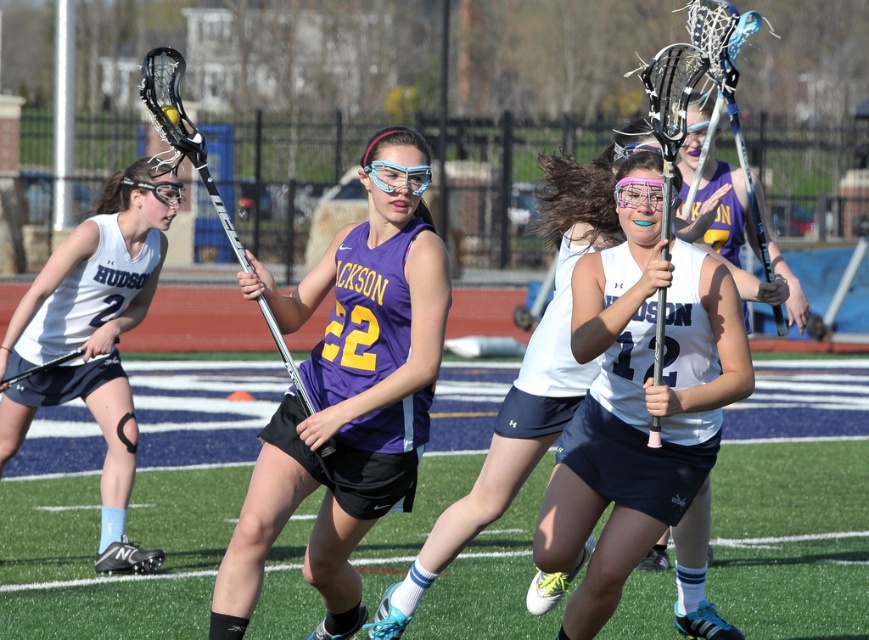
Based on the photo, you are a player on the field and want to pass the ball to a teammate who is at point (660, 477). You are currently at point (403, 173). Which direction should you aim to pass the ball?

You should aim the ball towards the direction of point (660, 477), which is further away from you compared to point (403, 173).

You are a spectator at the lacrosse game and want to take a photo of the purple matte lacrosse stick at center and the white matte uniform at left. Which object should you focus on first to ensure both are in clear view?

You should focus on the purple matte lacrosse stick at center first because it is closer to the viewer than the white matte uniform at left, so adjusting focus from near to far will help both be in clear view.

You are a referee observing the lacrosse game. You notice two items at the center of the field. One is the white matte jersey at center and the other is the clear plastic goggles at center. According to the game rules, players must wear their goggles above their jerseys. Is the current positioning of these items compliant with the rule?

The white matte jersey at center is in front of the clear plastic goggles at center, which means the goggles are positioned behind the jersey. This does not comply with the rule requiring goggles to be worn above the jersey.